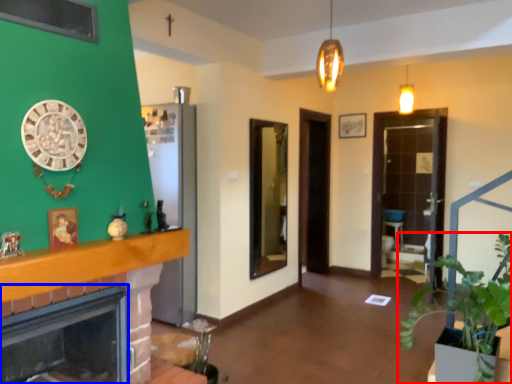
Question: Which object appears farthest to the camera in this image, houseplant (highlighted by a red box) or fireplace (highlighted by a blue box)?

Choices:
 (A) houseplant
 (B) fireplace

Answer: (A)